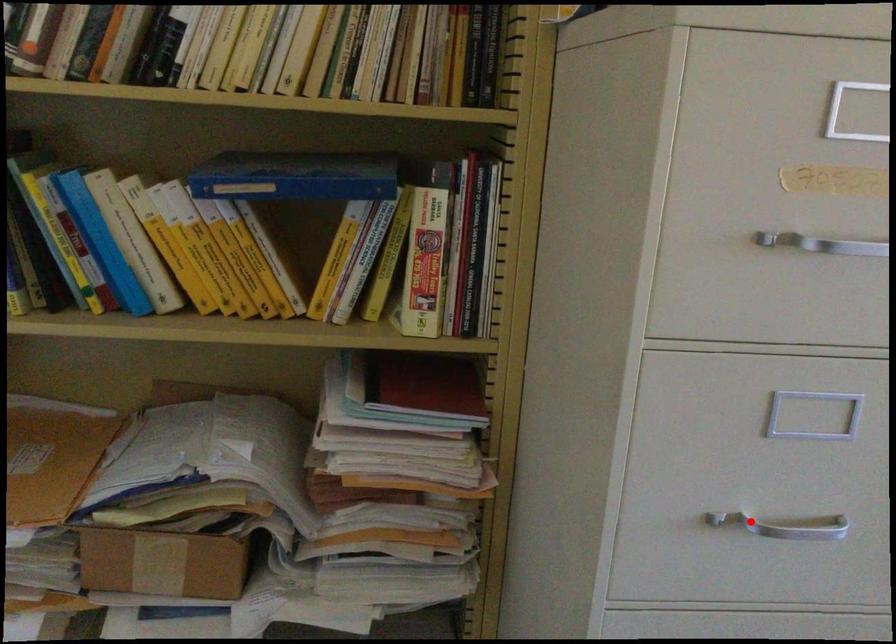
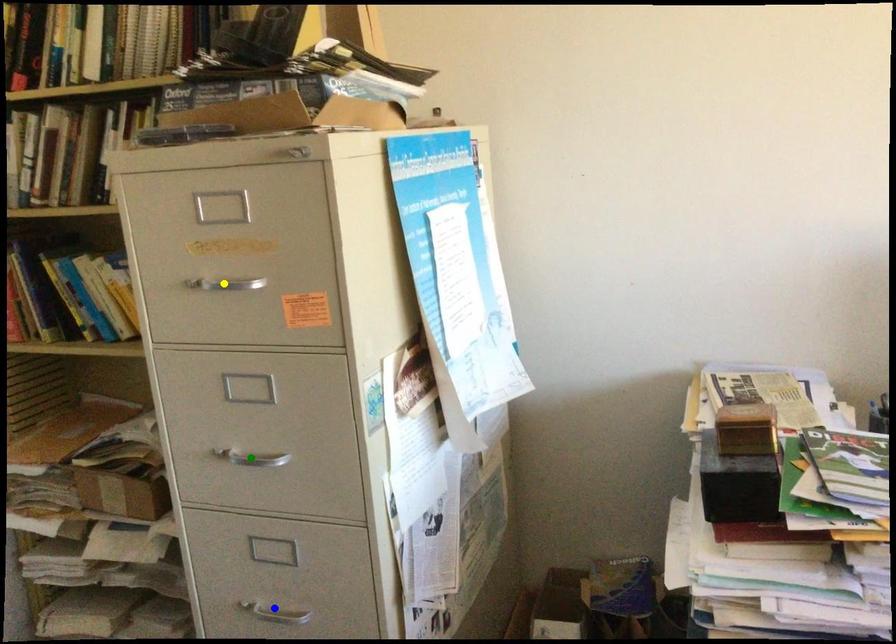
Question: I am providing you with two images of the same scene from different viewpoints. A red point is marked on the first image. You are given multiple points on the second image. In image 2, which mark is for the same physical point as the one in image 1?

Choices:
 (A) blue point
 (B) green point
 (C) yellow point

Answer: (B)